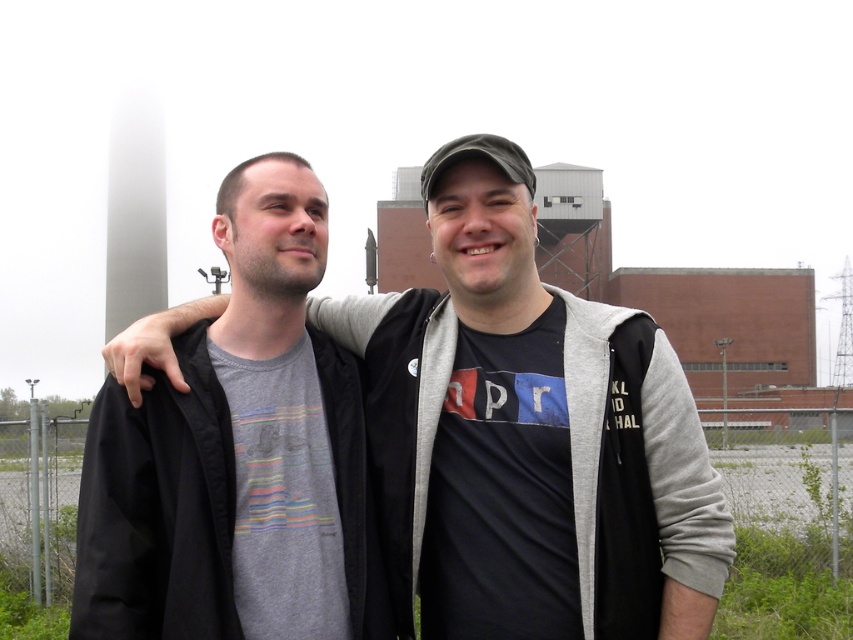
You are standing at the point closest to the smokestack in the image. There are two points marked in the image, one at coordinates point (683,428) and the other at point (155,628). Which of these points is farther away from you?

Point (683,428) is behind point (155,628), so it is farther away from you.

You are a photographer trying to focus on the gray cotton t shirt at center. You see a point at coordinates [529,435]. Is this point on the gray cotton t shirt at center?

Yes, the point at coordinates [529,435] is on the gray cotton t shirt at center.